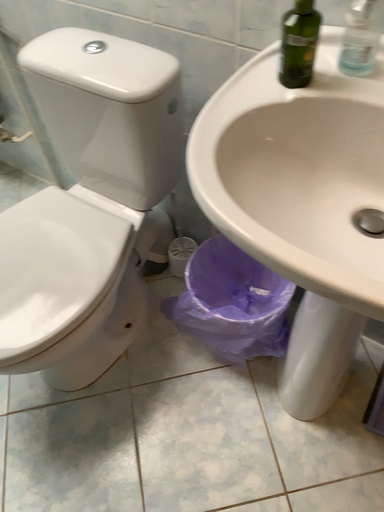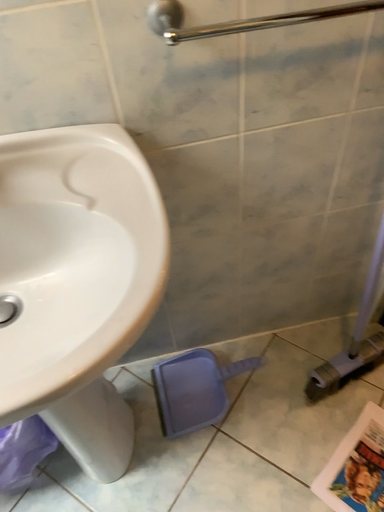
Question: How did the camera likely rotate when shooting the video?

Choices:
 (A) rotated upward
 (B) rotated downward

Answer: (A)